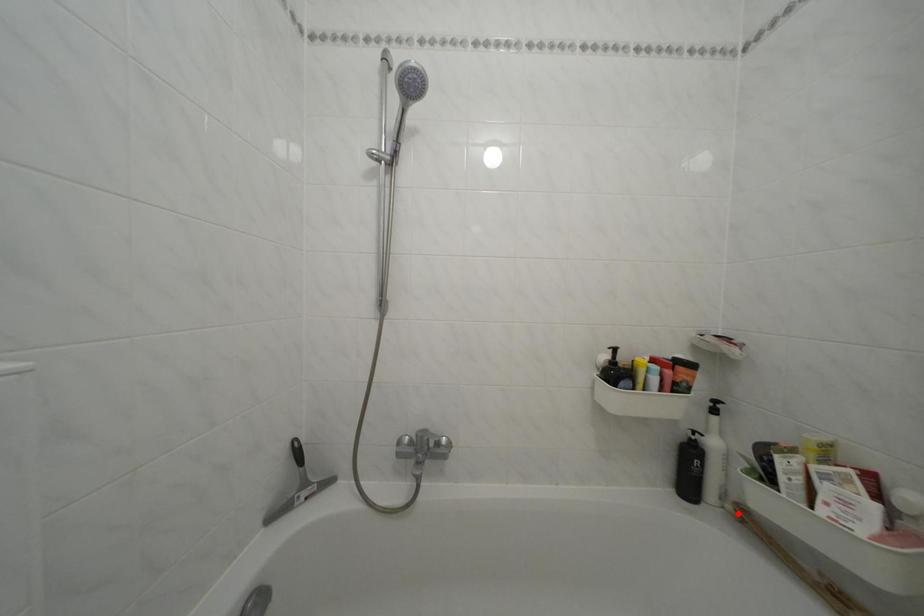
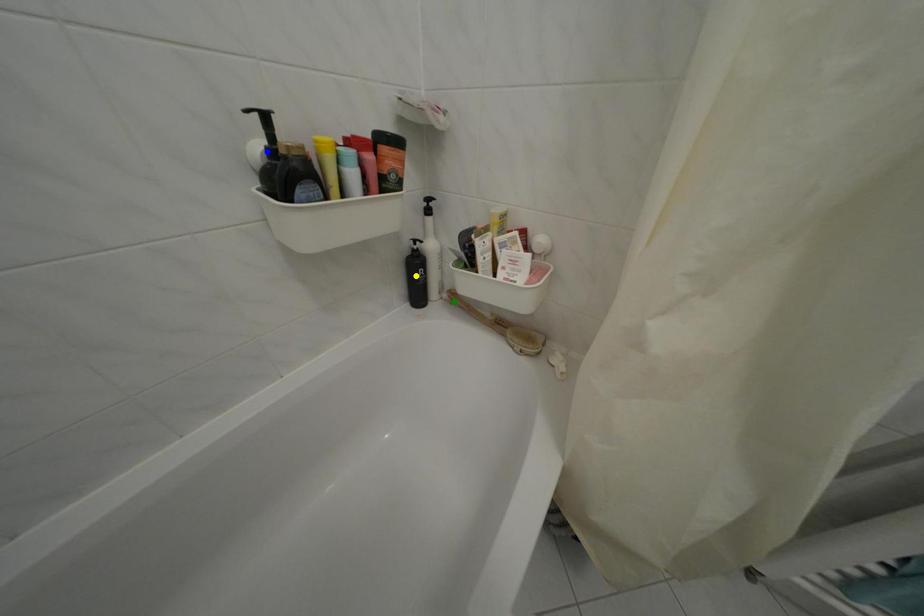
Question: I am providing you with two images of the same scene from different viewpoints. A red point is marked on the first image. You are given multiple points on the second image. Can you choose the point in image 2 that corresponds to the point in image 1?

Choices:
 (A) green point
 (B) yellow point
 (C) blue point

Answer: (A)